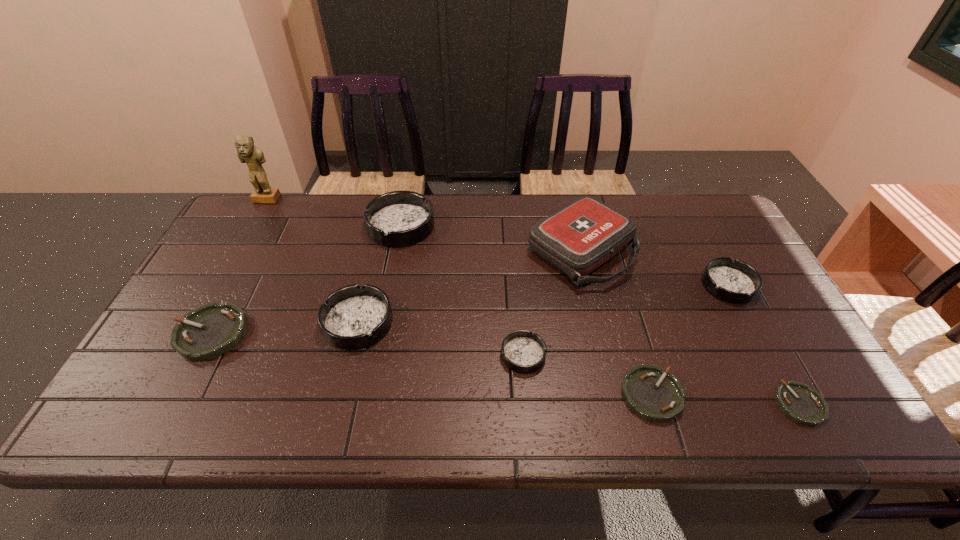
The width and height of the screenshot is (960, 540). I want to click on the tallest object, so click(253, 156).

You are a GUI agent. You are given a task and a screenshot of the screen. Output one action in this format:
    pyautogui.click(x=<x>, y=<y>)
    Task: Click on the red first-aid kit
    
    Given the screenshot: What is the action you would take?
    pyautogui.click(x=577, y=239)

Where is `the second tallest object`? The width and height of the screenshot is (960, 540). the second tallest object is located at coordinates (577, 239).

Where is `the seventh shortest object`? the seventh shortest object is located at coordinates [399, 218].

Locate an element on the screen. The width and height of the screenshot is (960, 540). the farthest dark ashtray is located at coordinates (399, 218).

The width and height of the screenshot is (960, 540). In order to click on the sixth shortest object in this screenshot , I will do `click(353, 317)`.

Locate an element on the screen. the sixth shortest ashtray is located at coordinates (353, 317).

What are the coordinates of `the rightmost dark ashtray` in the screenshot? It's located at (737, 282).

I want to click on the fifth shortest object, so click(x=737, y=282).

Image resolution: width=960 pixels, height=540 pixels. In order to click on the farthest green ashtray in this screenshot , I will do `click(211, 330)`.